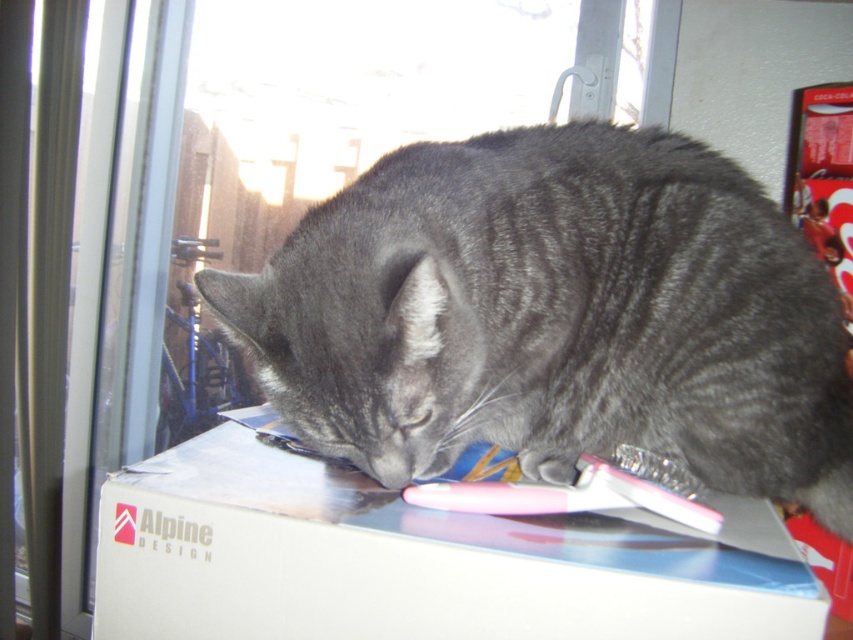
Question: Which point is closer to the camera taking this photo?

Choices:
 (A) (236, 461)
 (B) (563, 465)
 (C) (358, 253)

Answer: (C)

Question: Is white cardboard box at center smaller than gray fur paw at lower center?

Choices:
 (A) no
 (B) yes

Answer: (A)

Question: Which of the following is the farthest from the observer?

Choices:
 (A) white cardboard box at center
 (B) gray fur cat at center
 (C) gray fur paw at lower center

Answer: (C)

Question: Which point appears closest to the camera in this image?

Choices:
 (A) (467, 582)
 (B) (648, 353)

Answer: (A)

Question: Does white cardboard box at center have a greater width compared to gray fur paw at lower center?

Choices:
 (A) no
 (B) yes

Answer: (B)

Question: Does gray fur cat at center appear on the right side of gray fur paw at lower center?

Choices:
 (A) no
 (B) yes

Answer: (B)